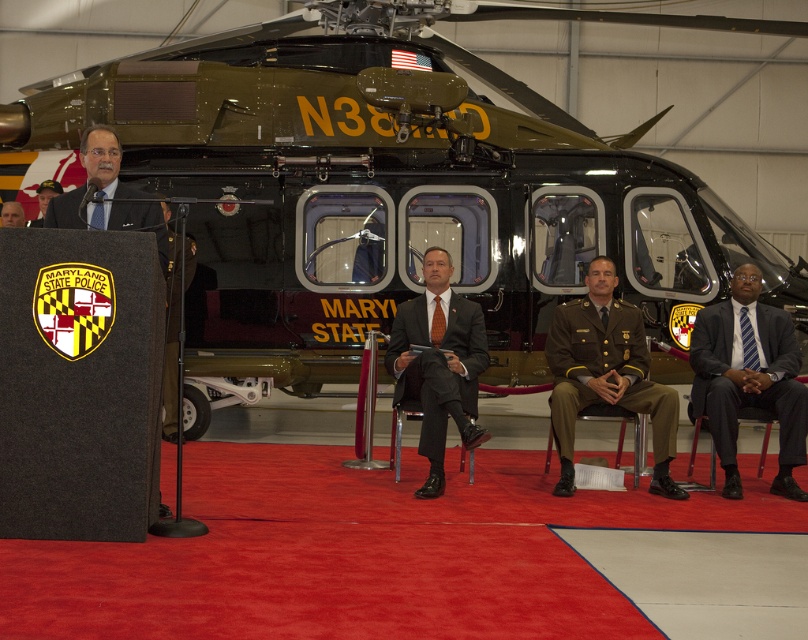
Which is more to the right, green fabric uniform at center or matte black suit at left?

green fabric uniform at center is more to the right.

Can you confirm if green fabric uniform at center is positioned to the right of matte black suit at left?

Indeed, green fabric uniform at center is positioned on the right side of matte black suit at left.

In order to click on green fabric uniform at center in this screenshot , I will do `click(171, 337)`.

Can you confirm if matte black suit at center is taller than light brown leather jacket at left?

Yes, matte black suit at center is taller than light brown leather jacket at left.

Can you confirm if matte black suit at center is bigger than light brown leather jacket at left?

Correct, matte black suit at center is larger in size than light brown leather jacket at left.

Image resolution: width=808 pixels, height=640 pixels. What do you see at coordinates (438, 364) in the screenshot? I see `matte black suit at center` at bounding box center [438, 364].

The height and width of the screenshot is (640, 808). I want to click on matte black suit at center, so click(438, 364).

Does point (177, 282) come behind point (7, 220)?

No.

Does green fabric uniform at center have a lesser height compared to light brown leather jacket at left?

No, green fabric uniform at center is not shorter than light brown leather jacket at left.

Between point (171, 305) and point (3, 214), which one is positioned in front?

Point (171, 305)

This screenshot has height=640, width=808. In order to click on green fabric uniform at center in this screenshot , I will do `click(171, 337)`.